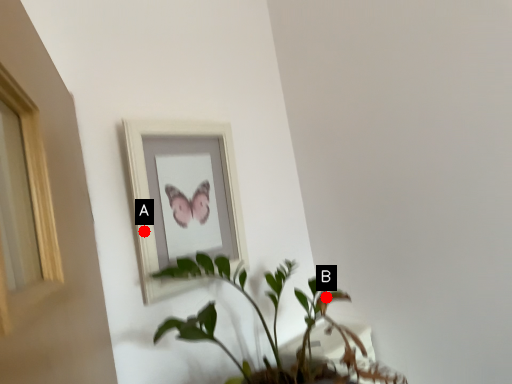
Question: Two points are circled on the image, labeled by A and B beside each circle. Which point is farther to the camera?

Choices:
 (A) A is further
 (B) B is further

Answer: (B)